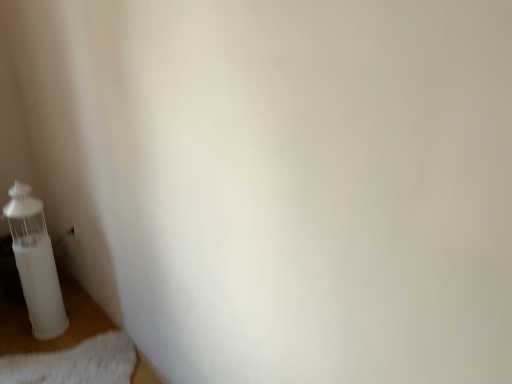
Image resolution: width=512 pixels, height=384 pixels. Describe the element at coordinates (35, 263) in the screenshot. I see `white matte bottle at lower left` at that location.

Find the location of a particular element. Image resolution: width=512 pixels, height=384 pixels. white matte bottle at lower left is located at coordinates (35, 263).

This screenshot has width=512, height=384. In order to click on white matte bottle at lower left in this screenshot , I will do `click(35, 263)`.